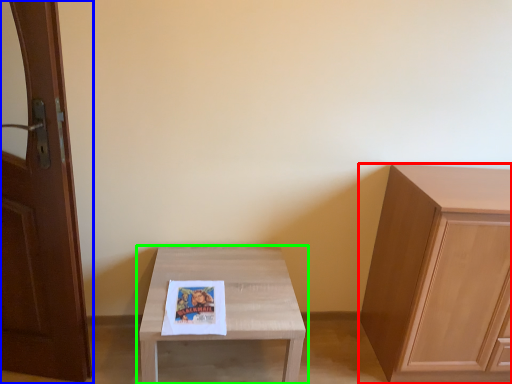
Question: Estimate the real-world distances between objects in this image. Which object is farther from cabinetry (highlighted by a red box), door (highlighted by a blue box) or table (highlighted by a green box)?

Choices:
 (A) door
 (B) table

Answer: (A)